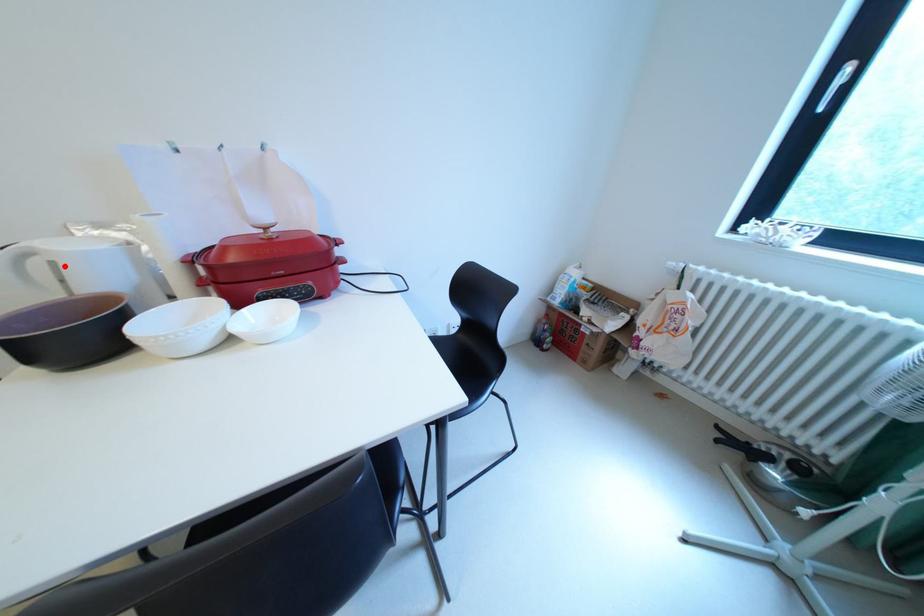
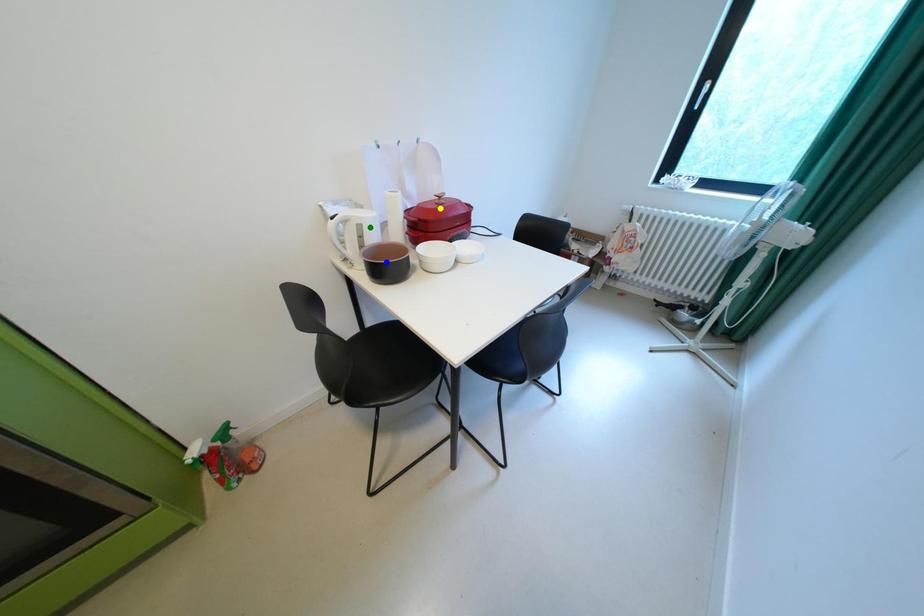
Question: I am providing you with two images of the same scene from different viewpoints. A red point is marked on the first image. You are given multiple points on the second image. Can you choose the point in image 2 that corresponds to the point in image 1?

Choices:
 (A) green point
 (B) yellow point
 (C) blue point

Answer: (A)